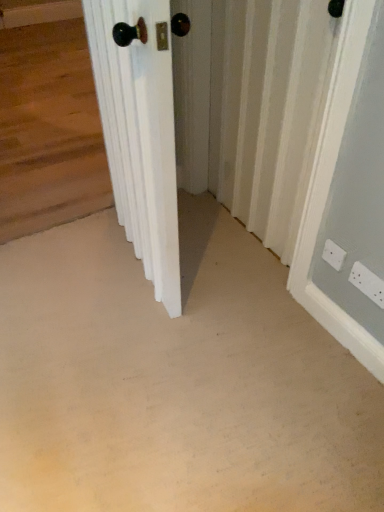
What are the coordinates of `empty space that is ontop of beige carpet at center (from a real-world perspective)` in the screenshot? It's located at (140, 327).